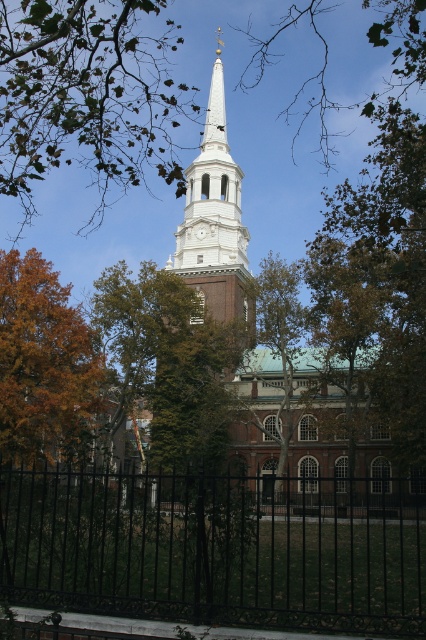
Question: Which point is farther to the camera?

Choices:
 (A) (0, 381)
 (B) (235, 195)
 (C) (201, 150)

Answer: (C)

Question: Can you confirm if orange leafy tree at left is thinner than white wood clock tower at center?

Choices:
 (A) yes
 (B) no

Answer: (B)

Question: Is green leafy tree at upper center bigger than white glossy steeple at upper center?

Choices:
 (A) no
 (B) yes

Answer: (B)

Question: Which object is closer to the camera taking this photo?

Choices:
 (A) black wrought iron fence at lower center
 (B) green leafy tree at center
 (C) orange leafy tree at left

Answer: (A)

Question: Which object is closer to the camera taking this photo?

Choices:
 (A) green leafy tree at upper center
 (B) white glossy steeple at upper center
 (C) orange leafy tree at left
 (D) black wrought iron fence at lower center

Answer: (D)

Question: Does green leafy tree at upper center have a smaller size compared to white glossy steeple at upper center?

Choices:
 (A) yes
 (B) no

Answer: (B)